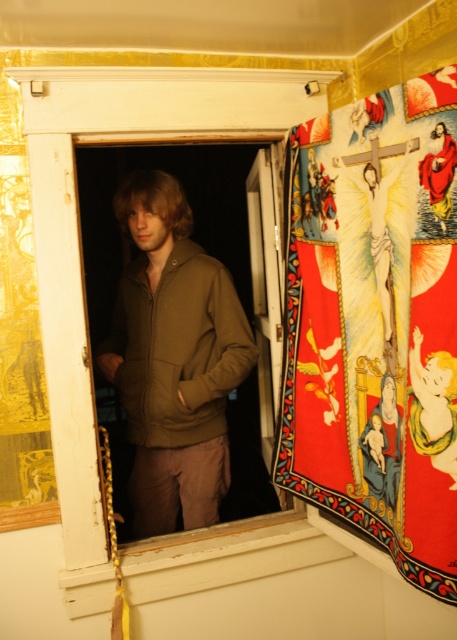
Based on the photo, you are standing in the doorway and want to hang a new picture frame exactly where the vibrant fabric tapestry at right is currently hanging. According to the coordinates provided, where should you place the new frame?

The vibrant fabric tapestry at right is located at point (x=376, y=323), so you should place the new picture frame at those coordinates to match its current position.